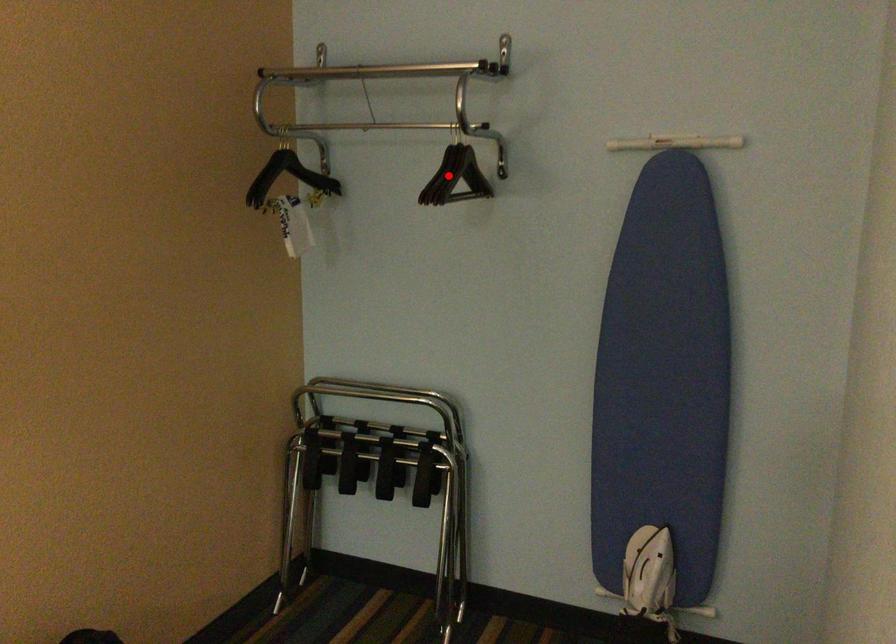
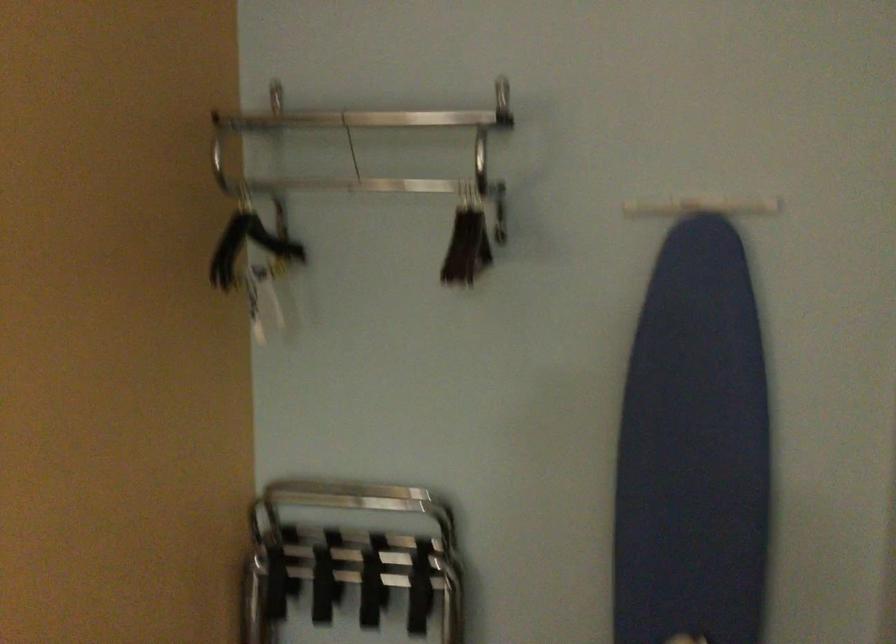
Question: A red point is marked in image1. In image2, is the corresponding 3D point closer to the camera or farther? Reply with the corresponding letter.

Choices:
 (A) The corresponding 3D point is closer.
 (B) The corresponding 3D point is farther.

Answer: (A)